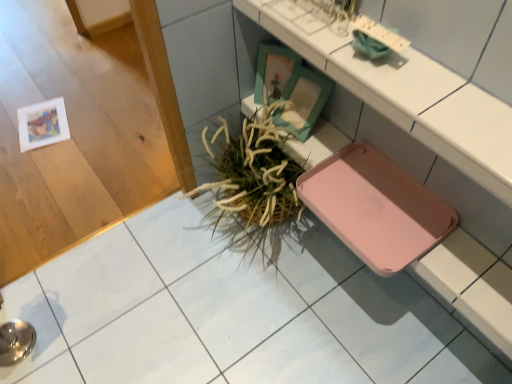
Where is `green woven basket at center`? Image resolution: width=512 pixels, height=384 pixels. green woven basket at center is located at coordinates (254, 171).

Describe the element at coordinates (32, 324) in the screenshot. Image resolution: width=512 pixels, height=384 pixels. I see `metallic silver bowl at lower left` at that location.

Identify the location of pink plastic tray at lower right. (375, 207).

At what (x,y) coordinates should I click in order to perform the action: click on matte white counter at center. Please return your answer as a coordinate pair (x, y). Looking at the image, I should click on (412, 99).

Considering the sizes of objects matte white counter at center and metallic silver bowl at lower left in the image provided, who is wider, matte white counter at center or metallic silver bowl at lower left?

metallic silver bowl at lower left.

Looking at this image, which is more to the right, matte white counter at center or metallic silver bowl at lower left?

matte white counter at center is more to the right.

From the image's perspective, relative to metallic silver bowl at lower left, is matte white counter at center above or below?

matte white counter at center is situated higher than metallic silver bowl at lower left in the image.

Is the depth of matte white counter at center greater than that of metallic silver bowl at lower left?

No, matte white counter at center is closer to the camera.

From a real-world perspective, is matte white counter at center positioned over pink plastic tray at lower right based on gravity?

Yes.

Can you confirm if matte white counter at center is thinner than pink plastic tray at lower right?

Correct, the width of matte white counter at center is less than that of pink plastic tray at lower right.

Does matte white counter at center lie behind pink plastic tray at lower right?

No, matte white counter at center is in front of pink plastic tray at lower right.

Is matte white counter at center looking in the opposite direction of pink plastic tray at lower right?

No, pink plastic tray at lower right is not at the back of matte white counter at center.

How different are the orientations of green woven basket at center and matte white counter at center in degrees?

The angle between the facing direction of green woven basket at center and the facing direction of matte white counter at center is 0.757 degrees.

Between green woven basket at center and matte white counter at center, which one appears on the right side from the viewer's perspective?

Positioned to the right is matte white counter at center.

Is green woven basket at center situated inside matte white counter at center or outside?

green woven basket at center cannot be found inside matte white counter at center.

Does point (250, 208) come in front of point (501, 165)?

No, it is behind (501, 165).

Is metallic silver bowl at lower left to the left of green woven basket at center from the viewer's perspective?

Indeed, metallic silver bowl at lower left is positioned on the left side of green woven basket at center.

From a real-world perspective, which object stands above the other?

green woven basket at center is physically above.

Considering the relative sizes of metallic silver bowl at lower left and green woven basket at center in the image provided, is metallic silver bowl at lower left shorter than green woven basket at center?

Yes.

Is pink plastic tray at lower right at the back of green woven basket at center?

No, green woven basket at center is not facing away from pink plastic tray at lower right.

From the image's perspective, which one is positioned higher, green woven basket at center or pink plastic tray at lower right?

green woven basket at center, from the image's perspective.

Between green woven basket at center and pink plastic tray at lower right, which one has smaller width?

pink plastic tray at lower right is thinner.

Considering the sizes of objects green woven basket at center and metallic silver bowl at lower left in the image provided, who is smaller, green woven basket at center or metallic silver bowl at lower left?

With smaller size is metallic silver bowl at lower left.

You are a GUI agent. You are given a task and a screenshot of the screen. Output one action in this format:
    pyautogui.click(x=<x>, y=<y>)
    Task: Click on the square beneath the green woven basket at center (from a real-world perspective)
    This screenshot has width=512, height=384.
    Given the screenshot: What is the action you would take?
    pyautogui.click(x=32, y=324)

How different are the orientations of green woven basket at center and metallic silver bowl at lower left in degrees?

There is a 90.3-degree angle between the facing directions of green woven basket at center and metallic silver bowl at lower left.

Is green woven basket at center situated inside metallic silver bowl at lower left or outside?

The correct answer is: outside.

Where is `pad on the right of the metallic silver bowl at lower left`? The height and width of the screenshot is (384, 512). pad on the right of the metallic silver bowl at lower left is located at coordinates (375, 207).

Does metallic silver bowl at lower left have a greater width compared to pink plastic tray at lower right?

In fact, metallic silver bowl at lower left might be narrower than pink plastic tray at lower right.

Between point (7, 307) and point (425, 227), which one is positioned behind?

Positioned behind is point (7, 307).

Is metallic silver bowl at lower left further to camera compared to pink plastic tray at lower right?

No, metallic silver bowl at lower left is closer to the viewer.

In the image, there is a metallic silver bowl at lower left. Where is `counter above it (from the image's perspective)`? This screenshot has height=384, width=512. counter above it (from the image's perspective) is located at coordinates (412, 99).

Where is `counter on the left of pink plastic tray at lower right`? counter on the left of pink plastic tray at lower right is located at coordinates (412, 99).

When comparing their distances from green woven basket at center, does matte white counter at center or metallic silver bowl at lower left seem further?

metallic silver bowl at lower left is positioned further to the anchor green woven basket at center.

Looking at the image, which one is located closer to matte white counter at center, green woven basket at center or metallic silver bowl at lower left?

Among the two, green woven basket at center is located nearer to matte white counter at center.

Considering their positions, is matte white counter at center positioned further to pink plastic tray at lower right than metallic silver bowl at lower left?

metallic silver bowl at lower left is further to pink plastic tray at lower right.

Looking at this image, when comparing their distances from matte white counter at center, does metallic silver bowl at lower left or green woven basket at center seem further?

metallic silver bowl at lower left lies further to matte white counter at center than the other object.

Looking at the image, which one is located closer to pink plastic tray at lower right, matte white counter at center or green woven basket at center?

Based on the image, green woven basket at center appears to be nearer to pink plastic tray at lower right.

Which object lies nearer to the anchor point green woven basket at center, pink plastic tray at lower right or matte white counter at center?

pink plastic tray at lower right.

Considering their positions, is green woven basket at center positioned closer to matte white counter at center than pink plastic tray at lower right?

pink plastic tray at lower right is positioned closer to the anchor matte white counter at center.

When comparing their distances from metallic silver bowl at lower left, does matte white counter at center or green woven basket at center seem closer?

The object closer to metallic silver bowl at lower left is green woven basket at center.

Where is `counter located between green woven basket at center and pink plastic tray at lower right in the left-right direction`? counter located between green woven basket at center and pink plastic tray at lower right in the left-right direction is located at coordinates (412, 99).

Locate an element on the screen. The height and width of the screenshot is (384, 512). houseplant between metallic silver bowl at lower left and matte white counter at center in the horizontal direction is located at coordinates (254, 171).

Where is `counter situated between metallic silver bowl at lower left and pink plastic tray at lower right from left to right`? counter situated between metallic silver bowl at lower left and pink plastic tray at lower right from left to right is located at coordinates (412, 99).

This screenshot has width=512, height=384. I want to click on houseplant between metallic silver bowl at lower left and pink plastic tray at lower right in the horizontal direction, so click(x=254, y=171).